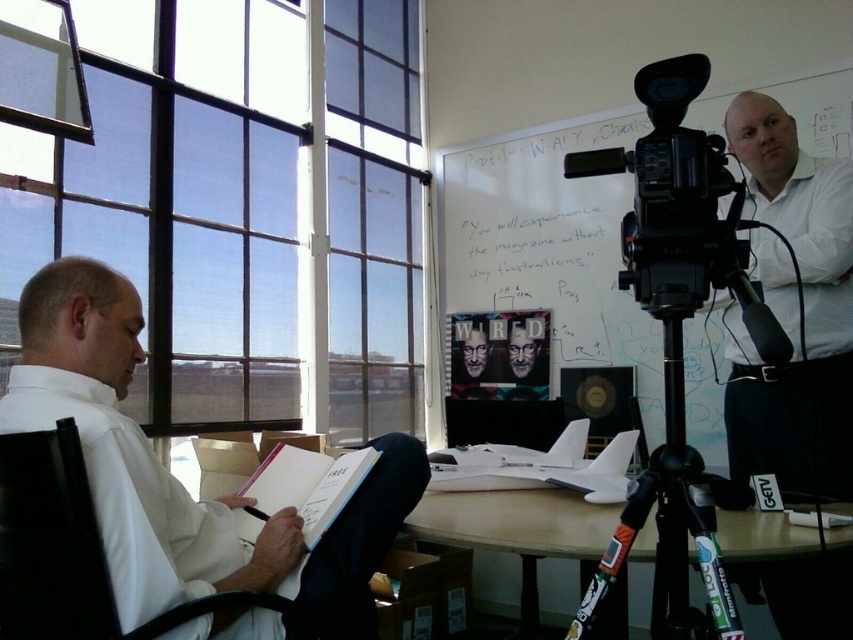
You are standing in the office scene described. There is a point at coordinates (129,449). Which object from the list is located at that point?

The white shirt at left is located at point (129,449).

You are organizing a small meeting in this office and need to place a round table between the black leather swivel chair at left and the black plastic tripod at center. Given their sizes, which object should be closer to the table to ensure enough space for people to move around?

The black plastic tripod at center is larger than the black leather swivel chair at left, so placing the table closer to the tripod would provide more space around the chair for movement.